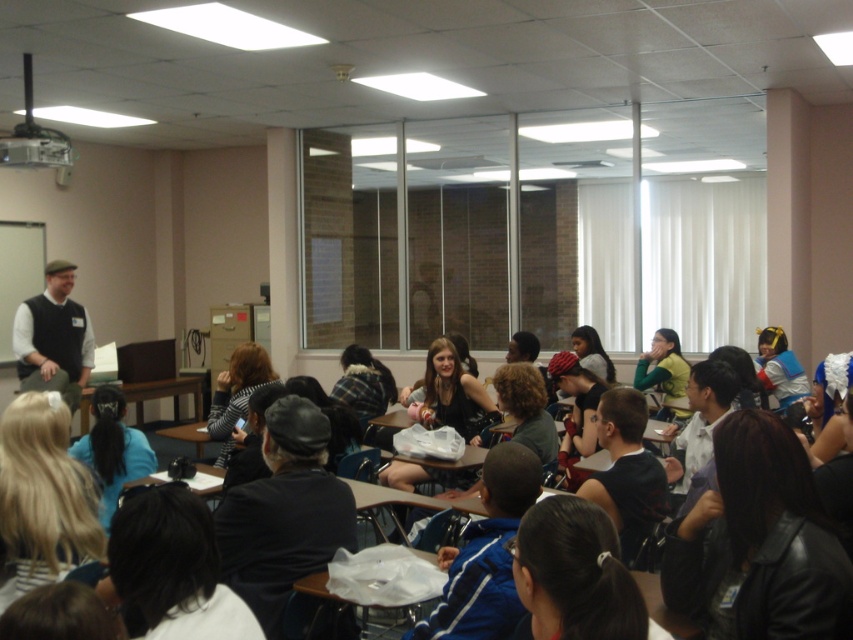
Measure the distance from black leather jacket at lower right to matte black vest at left.

A distance of 5.32 meters exists between black leather jacket at lower right and matte black vest at left.

Is black leather jacket at lower right to the left of matte black vest at left from the viewer's perspective?

In fact, black leather jacket at lower right is to the right of matte black vest at left.

Between point (723, 428) and point (49, 369), which one is positioned behind?

The point (49, 369) is more distant.

Find the location of a particular element. The height and width of the screenshot is (640, 853). black leather jacket at lower right is located at coordinates (758, 541).